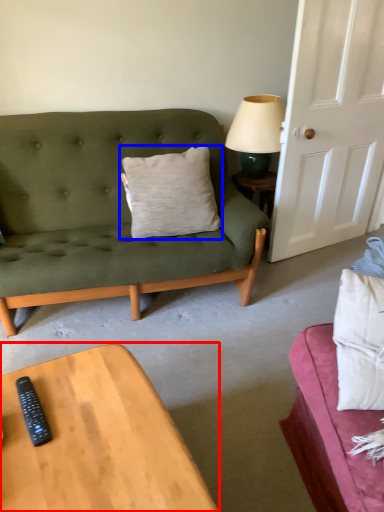
Question: Which of the following is the farthest to the observer, coffee table (highlighted by a red box) or pillow (highlighted by a blue box)?

Choices:
 (A) coffee table
 (B) pillow

Answer: (B)